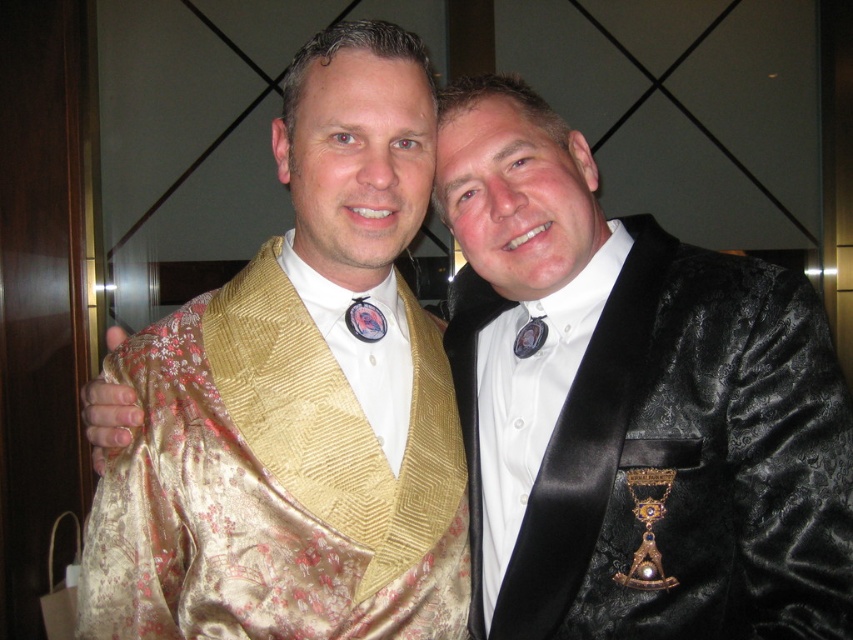
You are a photographer setting up a studio shoot for two models wearing the gold satin kimono at left and the black velvet suit at right. You need to arrange them so that the narrower garment is on the side closer to the camera to avoid blocking the face. Based on their widths, which model should you place closer to the camera?

→ The black velvet suit at right is narrower than the gold satin kimono at left, so you should position the model wearing the black velvet suit at right closer to the camera to prevent the wider kimono from blocking the face.

You are a photographer setting up a shot. You have a camera focused on the gold satin kimono at left. The subject wearing the kimono steps forward by 1 foot. Is the kimono now closer to or farther from the camera than before?

The gold satin kimono at left was originally 3.52 feet from the camera. After stepping forward by 1 foot, it is now 2.52 feet away, so it is closer to the camera than before.

You are a photographer setting up a portrait session for two people. You have a backdrop that is 1.8 meters tall. The subjects will be wearing the gold satin kimono at left and the black velvet suit at right. Based on their attire heights, will the backdrop be sufficient to cover them both fully?

The gold satin kimono at left has a greater height compared to the black velvet suit at right. Since the backdrop is 1.8 meters tall, if the gold satin kimono at left is taller than 1.8 meters, it may not be fully covered. However, without specific measurements of their heights, it is uncertain if the backdrop will suffice.